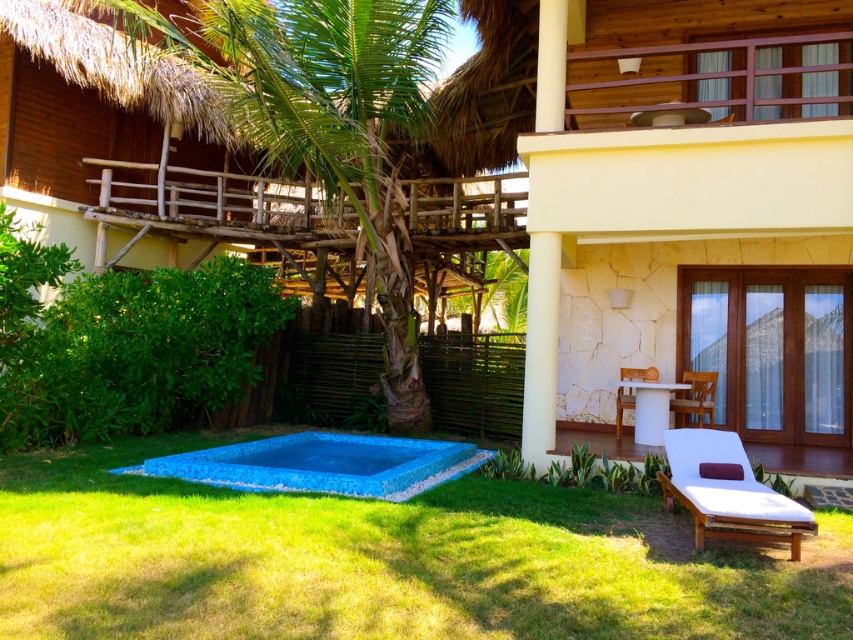
Question: Which point appears closest to the camera in this image?

Choices:
 (A) (693, 456)
 (B) (648, 602)

Answer: (B)

Question: Which object appears closest to the camera in this image?

Choices:
 (A) blue mosaic tiles at center
 (B) green grass at lower center
 (C) white fabric chaise lounge at lower right

Answer: (B)

Question: Does green grass at lower center have a lesser width compared to blue mosaic tiles at center?

Choices:
 (A) no
 (B) yes

Answer: (B)

Question: Estimate the real-world distances between objects in this image. Which object is closer to the blue mosaic tiles at center?

Choices:
 (A) white fabric chaise lounge at lower right
 (B) green grass at lower center

Answer: (B)

Question: Can you confirm if blue mosaic tiles at center is positioned to the right of white fabric chaise lounge at lower right?

Choices:
 (A) yes
 (B) no

Answer: (B)

Question: Is green grass at lower center above blue mosaic tiles at center?

Choices:
 (A) yes
 (B) no

Answer: (A)